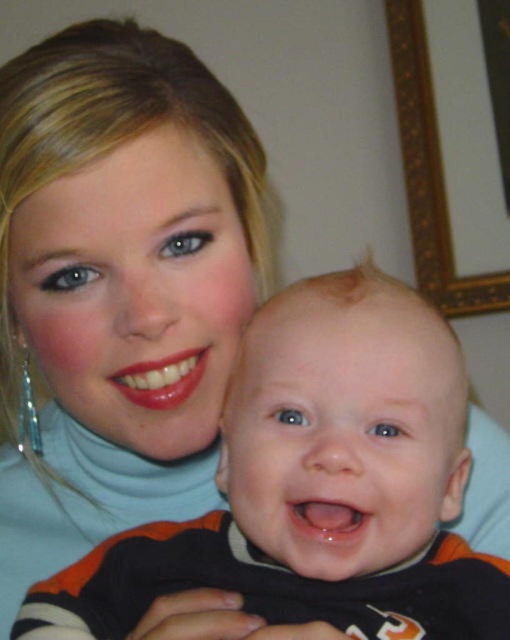
Question: Is black cotton onesie at center above gold ornate frame at upper right?

Choices:
 (A) yes
 (B) no

Answer: (B)

Question: Can you confirm if black cotton onesie at center is positioned below gold ornate frame at upper right?

Choices:
 (A) yes
 (B) no

Answer: (A)

Question: Which point is closer to the camera?

Choices:
 (A) gold ornate frame at upper right
 (B) black cotton onesie at center

Answer: (B)

Question: Can you confirm if black cotton onesie at center is wider than gold ornate frame at upper right?

Choices:
 (A) no
 (B) yes

Answer: (B)

Question: Which object is farther from the camera taking this photo?

Choices:
 (A) gold ornate frame at upper right
 (B) black cotton onesie at center

Answer: (A)